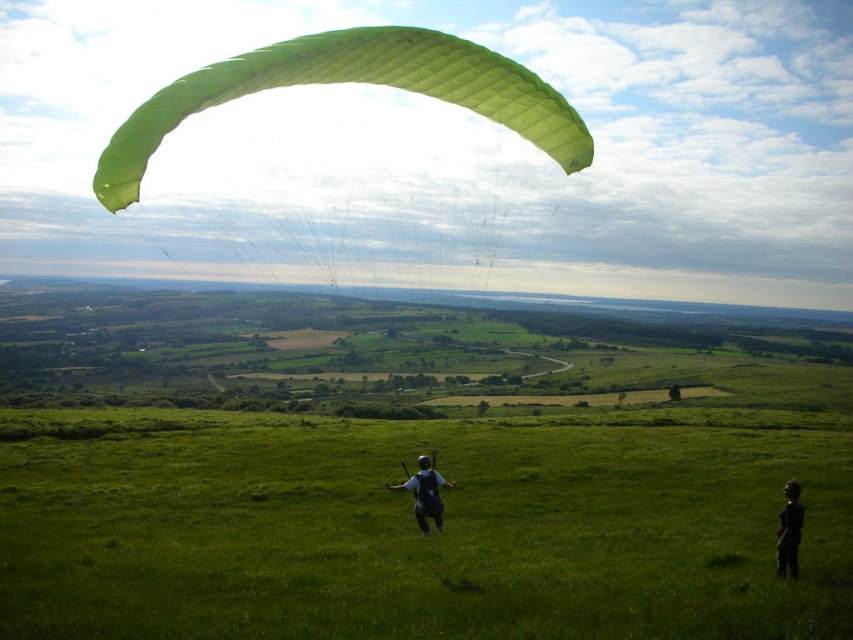
You are a photographer trying to capture the paraglider in the image. The paraglider is at point (x=352, y=81). You want to ensure the paraglider is centered in your shot. Is the paraglider already centered in the frame?

The point (x=352, y=81) where the paraglider is located is on the green fabric parachute at upper center, so yes, the paraglider is already centered in the frame.